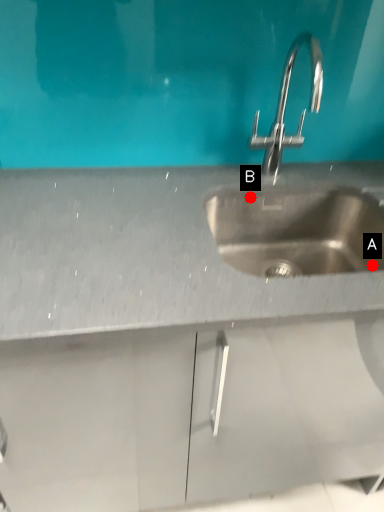
Question: Two points are circled on the image, labeled by A and B beside each circle. Which point is closer to the camera taking this photo?

Choices:
 (A) A is closer
 (B) B is closer

Answer: (A)